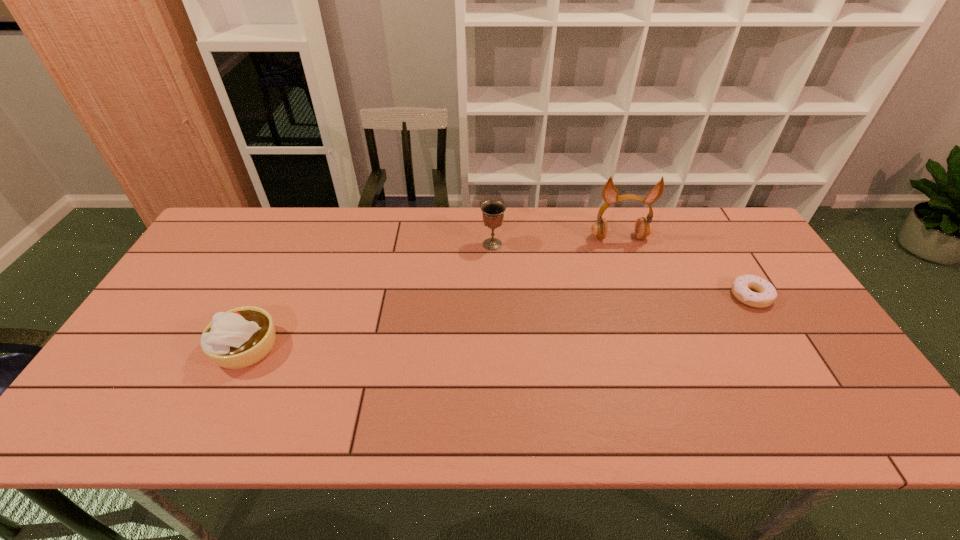
Identify the location of blank region between the doughnut and the earphone. The width and height of the screenshot is (960, 540). (684, 267).

You are a GUI agent. You are given a task and a screenshot of the screen. Output one action in this format:
    pyautogui.click(x=<x>, y=<y>)
    Task: Click on the free space between the earphone and the third shortest object
    The image size is (960, 540).
    Given the screenshot: What is the action you would take?
    pyautogui.click(x=556, y=241)

Where is `vacant region between the rightmost object and the chalice`? This screenshot has height=540, width=960. vacant region between the rightmost object and the chalice is located at coordinates (621, 270).

Locate an element on the screen. The image size is (960, 540). blank region between the third shortest object and the nearest object is located at coordinates (370, 296).

This screenshot has width=960, height=540. Identify the location of free area in between the third object from left to right and the second object from left to right. (556, 241).

The height and width of the screenshot is (540, 960). I want to click on empty space between the doughnut and the second object from right to left, so click(x=684, y=267).

In order to click on free space between the doughnut and the second object from left to right in this screenshot , I will do `click(621, 270)`.

Identify the location of free point between the chalice and the third farthest object. (621, 270).

Locate an element on the screen. This screenshot has height=540, width=960. vacant area between the second shortest object and the tallest object is located at coordinates (433, 293).

At what (x,y) coordinates should I click in order to perform the action: click on vacant region between the chalice and the shortest object. Please return your answer as a coordinate pair (x, y). Looking at the image, I should click on (621, 270).